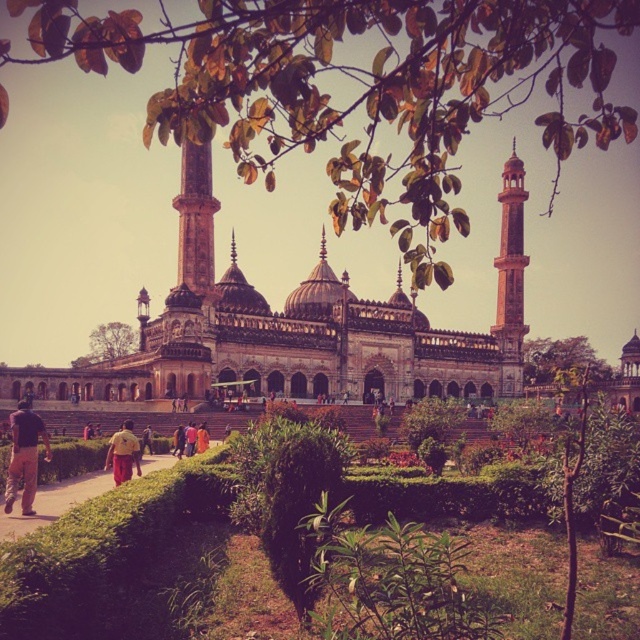
Who is more forward, (28, 508) or (131, 452)?

Point (28, 508)

Where is `brown cotton pants at lower left`? This screenshot has height=640, width=640. brown cotton pants at lower left is located at coordinates (24, 456).

Which is more to the left, brown paved path at lower center or brown cotton pants at lower left?

brown cotton pants at lower left

Who is shorter, brown paved path at lower center or brown cotton pants at lower left?

Standing shorter between the two is brown paved path at lower center.

Is point (83, 497) less distant than point (29, 413)?

That is False.

At what (x,y) coordinates should I click in order to perform the action: click on brown paved path at lower center. Please return your answer as a coordinate pair (x, y). This screenshot has height=640, width=640. Looking at the image, I should click on (54, 502).

Can you confirm if green leafy garden at center is wider than yellow fabric pants at lower center?

Yes.

Is point (113, 528) positioned after point (129, 419)?

No, it is in front of (129, 419).

Who is more distant from viewer, (122,548) or (109,461)?

The point (109,461) is behind.

Identify the location of green leafy garden at center. This screenshot has height=640, width=640. (108, 556).